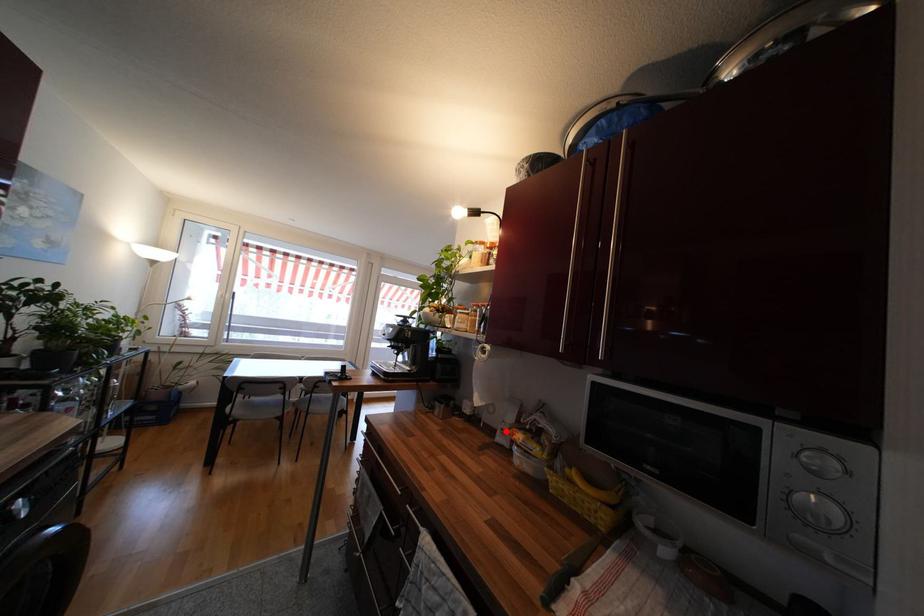
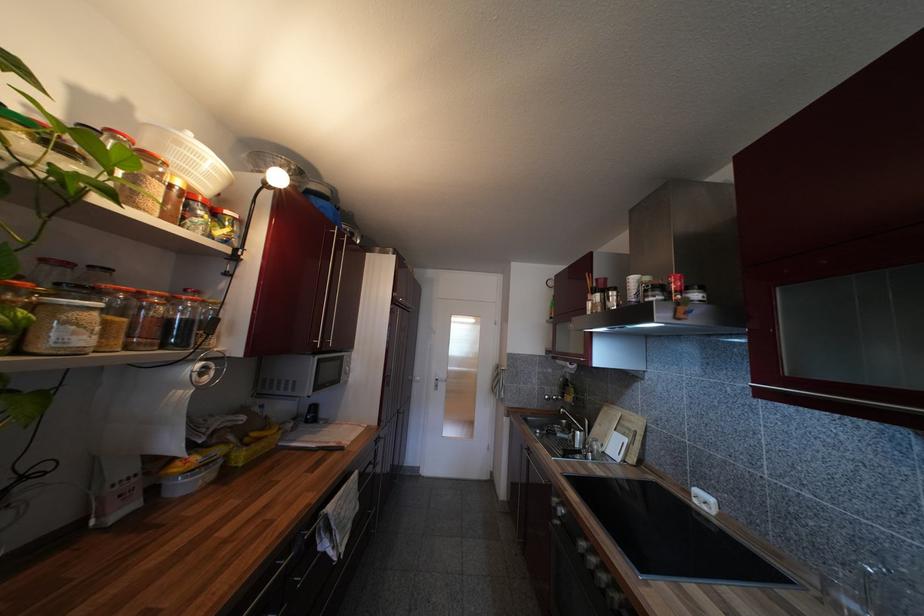
Question: I am providing you with two images of the same scene from different viewpoints. Given a red point in image1, look at the same physical point in image2. Is it:

Choices:
 (A) Closer to the viewpoint
 (B) Farther from the viewpoint

Answer: (A)